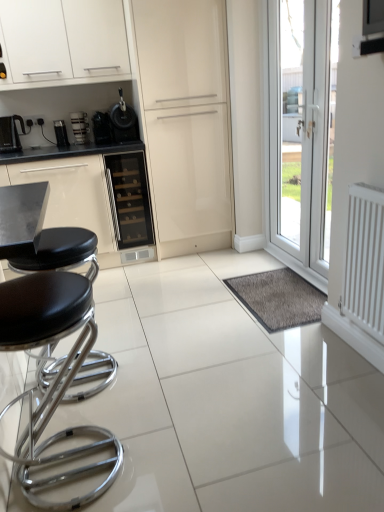
I want to click on matte black coffee machine at left, positioned as the 1th coffee machine in left-to-right order, so click(11, 134).

Image resolution: width=384 pixels, height=512 pixels. What do you see at coordinates (186, 121) in the screenshot?
I see `glossy cream cabinet at center` at bounding box center [186, 121].

Where is `black glass wine cooler at center`? The width and height of the screenshot is (384, 512). black glass wine cooler at center is located at coordinates (129, 199).

Describe the element at coordinates (129, 199) in the screenshot. The image size is (384, 512). I see `black glass wine cooler at center` at that location.

What do you see at coordinates (123, 121) in the screenshot?
I see `black matte coffee maker at center, which is the 1th appliance from right to left` at bounding box center [123, 121].

Where is `white matte radiator at right`? Image resolution: width=384 pixels, height=512 pixels. white matte radiator at right is located at coordinates (364, 260).

Measure the distance from black leather stool at left, the second stool from the back, to matte black coffee maker at left, the first appliance viewed from the left.

black leather stool at left, the second stool from the back, and matte black coffee maker at left, the first appliance viewed from the left, are 6.75 feet apart.

Are black leather stool at left, the second stool from the back, and matte black coffee maker at left, the first appliance viewed from the left, located far from each other?

Absolutely, black leather stool at left, the second stool from the back, is distant from matte black coffee maker at left, the first appliance viewed from the left.

From a real-world perspective, is black leather stool at left, the second stool from the back, over matte black coffee maker at left, which is the 3th appliance in right-to-left order?

Actually, black leather stool at left, the second stool from the back, is physically below matte black coffee maker at left, which is the 3th appliance in right-to-left order, in the real world.

Looking at their sizes, would you say black leather stool at left, which is the first stool from front to back, is wider or thinner than matte black coffee maker at left, the first appliance viewed from the left?

Considering their sizes, black leather stool at left, which is the first stool from front to back, looks broader than matte black coffee maker at left, the first appliance viewed from the left.

In terms of size, does black leather stool at left, which is the 2th stool in front-to-back order, appear bigger or smaller than satin black coffee machine at center, acting as the 2th coffee machine starting from the left?

black leather stool at left, which is the 2th stool in front-to-back order, is bigger than satin black coffee machine at center, acting as the 2th coffee machine starting from the left.

In the scene shown: From the image's perspective, relative to satin black coffee machine at center, which is the 1th coffee machine in right-to-left order, is black leather stool at left, the first stool in the back-to-front sequence, above or below?

Clearly, from the image's perspective, black leather stool at left, the first stool in the back-to-front sequence, is below satin black coffee machine at center, which is the 1th coffee machine in right-to-left order.

At what (x,y) coordinates should I click in order to perform the action: click on the 1st stool in front when counting from the satin black coffee machine at center, which is the 1th coffee machine in right-to-left order. Please return your answer as a coordinate pair (x, y). The height and width of the screenshot is (512, 384). Looking at the image, I should click on (61, 252).

Considering the positions of point (102, 120) and point (104, 482), is point (102, 120) closer or farther from the camera than point (104, 482)?

Clearly, point (102, 120) is more distant from the camera than point (104, 482).

From a real-world perspective, is black glass wine cooler at center, the 2th appliance positioned from the right, above or below black leather stool at left, which is the first stool from front to back?

From a real-world perspective, black glass wine cooler at center, the 2th appliance positioned from the right, is physically above black leather stool at left, which is the first stool from front to back.

Considering the positions of objects black glass wine cooler at center, the 2th appliance positioned from the left, and satin black coffee machine at center, acting as the 2th coffee machine starting from the left, in the image provided, who is more to the left, black glass wine cooler at center, the 2th appliance positioned from the left, or satin black coffee machine at center, acting as the 2th coffee machine starting from the left,?

satin black coffee machine at center, acting as the 2th coffee machine starting from the left, is more to the left.

Is black glass wine cooler at center, the 2th appliance positioned from the right, smaller than satin black coffee machine at center, acting as the 2th coffee machine starting from the left?

Incorrect, black glass wine cooler at center, the 2th appliance positioned from the right, is not smaller in size than satin black coffee machine at center, acting as the 2th coffee machine starting from the left.

How many degrees apart are the facing directions of black glass wine cooler at center, the 2th appliance positioned from the right, and satin black coffee machine at center, which is the 1th coffee machine in right-to-left order?

The angle between the facing direction of black glass wine cooler at center, the 2th appliance positioned from the right, and the facing direction of satin black coffee machine at center, which is the 1th coffee machine in right-to-left order, is 1.5 degrees.

Considering the sizes of objects black glass wine cooler at center, the 2th appliance positioned from the left, and satin black coffee machine at center, which is the 1th coffee machine in right-to-left order, in the image provided, who is wider, black glass wine cooler at center, the 2th appliance positioned from the left, or satin black coffee machine at center, which is the 1th coffee machine in right-to-left order,?

black glass wine cooler at center, the 2th appliance positioned from the left.

Can you tell me how much black leather stool at left, which is the 2th stool in front-to-back order, and glossy cream cabinet at center differ in facing direction?

The angular difference between black leather stool at left, which is the 2th stool in front-to-back order, and glossy cream cabinet at center is 88.7 degrees.

The height and width of the screenshot is (512, 384). There is a black leather stool at left, the first stool in the back-to-front sequence. In order to click on screen door above it (from a real-world perspective) in this screenshot , I will do (186, 121).

Which is closer, (24, 264) or (152, 58)?

Point (24, 264).

Is black leather stool at left, the first stool in the back-to-front sequence, oriented away from glossy cream cabinet at center?

No, black leather stool at left, the first stool in the back-to-front sequence, is not facing away from glossy cream cabinet at center.

Considering the relative sizes of matte black coffee machine at left, positioned as the 1th coffee machine in left-to-right order, and black glass wine cooler at center in the image provided, is matte black coffee machine at left, positioned as the 1th coffee machine in left-to-right order, taller than black glass wine cooler at center?

In fact, matte black coffee machine at left, positioned as the 1th coffee machine in left-to-right order, may be shorter than black glass wine cooler at center.

Is point (13, 144) closer or farther from the camera than point (135, 199)?

Point (13, 144) is closer to the camera than point (135, 199).

Is matte black coffee machine at left, the second coffee machine from the right, positioned beyond the bounds of black glass wine cooler at center?

matte black coffee machine at left, the second coffee machine from the right, lies outside black glass wine cooler at center's area.

In order to click on oven in front of the matte black coffee machine at left, positioned as the 1th coffee machine in left-to-right order in this screenshot , I will do (129, 199).

From the picture: Visually, is matte black coffee machine at left, positioned as the 1th coffee machine in left-to-right order, positioned to the left or to the right of black leather stool at left, the second stool from the back?

From the image, it's evident that matte black coffee machine at left, positioned as the 1th coffee machine in left-to-right order, is to the left of black leather stool at left, the second stool from the back.

Can you tell me how much matte black coffee machine at left, the second coffee machine from the right, and black leather stool at left, which is the first stool from front to back, differ in facing direction?

96.5 degrees separate the facing orientations of matte black coffee machine at left, the second coffee machine from the right, and black leather stool at left, which is the first stool from front to back.

Measure the distance from matte black coffee machine at left, the second coffee machine from the right, to black leather stool at left, the second stool from the back.

matte black coffee machine at left, the second coffee machine from the right, is 1.87 meters away from black leather stool at left, the second stool from the back.

This screenshot has height=512, width=384. Find the location of `the 2nd coffee machine counting from the left side of the black leather stool at left, which is the first stool from front to back`. the 2nd coffee machine counting from the left side of the black leather stool at left, which is the first stool from front to back is located at coordinates (11, 134).

From a real-world perspective, starting from the black leather stool at left, the second stool from the back, which appliance is the 1st one vertically above it? Please provide its 2D coordinates.

[(61, 133)]

At what (x,y) coordinates should I click in order to perform the action: click on the 1st stool in front of the satin black coffee machine at center, which is the 1th coffee machine in right-to-left order. Please return your answer as a coordinate pair (x, y). This screenshot has width=384, height=512. Looking at the image, I should click on (61, 252).

Consider the image. Which object lies further to the anchor point matte black coffee machine at left, the second coffee machine from the right, white matte radiator at right or white glossy cabinet at upper left?

The object further to matte black coffee machine at left, the second coffee machine from the right, is white matte radiator at right.

Based on their spatial positions, is glossy cream cabinet at center or matte black coffee maker at left, the first appliance viewed from the left, further from satin black coffee machine at center, which is the 1th coffee machine in right-to-left order?

glossy cream cabinet at center.

Considering their positions, is white matte radiator at right positioned closer to black glass wine cooler at center than transparent glass door at right?

The object closer to black glass wine cooler at center is transparent glass door at right.

When comparing their distances from transparent glass door at right, does black glass wine cooler at center or matte black coffee maker at left, which is the 3th appliance in right-to-left order, seem closer?

black glass wine cooler at center is positioned closer to the anchor transparent glass door at right.

Estimate the real-world distances between objects in this image. Which object is closer to black glass wine cooler at center, the 2th appliance positioned from the right, transparent glass door at right or white glossy cabinet at upper left?

white glossy cabinet at upper left is closer to black glass wine cooler at center, the 2th appliance positioned from the right.

When comparing their distances from white matte radiator at right, does glossy cream cabinet at center or black matte coffee maker at center, positioned as the 3th appliance in left-to-right order, seem further?

Based on the image, black matte coffee maker at center, positioned as the 3th appliance in left-to-right order, appears to be further to white matte radiator at right.

When comparing their distances from satin black coffee machine at center, which is the 1th coffee machine in right-to-left order, does glossy cream cabinet at center or white glossy cabinet at upper left seem further?

Among the two, glossy cream cabinet at center is located further to satin black coffee machine at center, which is the 1th coffee machine in right-to-left order.

Based on their spatial positions, is satin black coffee machine at center, acting as the 2th coffee machine starting from the left, or black leather stool at left, which is the first stool from front to back, closer to white matte radiator at right?

Based on the image, black leather stool at left, which is the first stool from front to back, appears to be nearer to white matte radiator at right.

At what (x,y) coordinates should I click in order to perform the action: click on screen door located between white matte radiator at right and black glass wine cooler at center, the 2th appliance positioned from the left, in the depth direction. Please return your answer as a coordinate pair (x, y). This screenshot has height=512, width=384. Looking at the image, I should click on (186, 121).

Where is `radiator between black leather stool at left, which is the first stool from front to back, and glossy cream cabinet at center in the front-back direction`? radiator between black leather stool at left, which is the first stool from front to back, and glossy cream cabinet at center in the front-back direction is located at coordinates (364, 260).

The height and width of the screenshot is (512, 384). In order to click on oven between white matte radiator at right and matte black coffee maker at left, which is the 3th appliance in right-to-left order, from front to back in this screenshot , I will do `click(129, 199)`.

Where is `appliance between black leather stool at left, the second stool from the back, and black glass wine cooler at center in the front-back direction`? The height and width of the screenshot is (512, 384). appliance between black leather stool at left, the second stool from the back, and black glass wine cooler at center in the front-back direction is located at coordinates (123, 121).